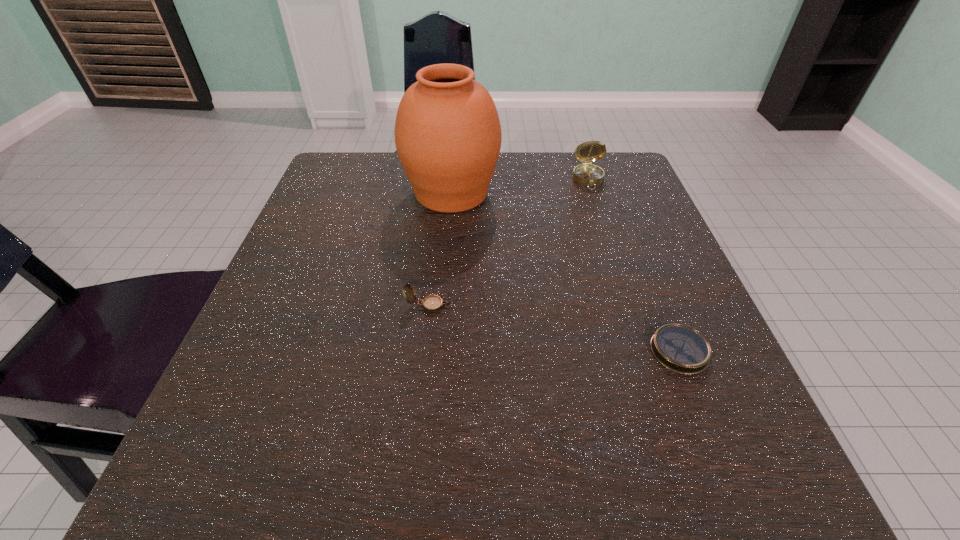
At what (x,y) coordinates should I click in order to perform the action: click on urn. Please return your answer as a coordinate pair (x, y). Looking at the image, I should click on (448, 136).

Where is `the second tallest object`? Image resolution: width=960 pixels, height=540 pixels. the second tallest object is located at coordinates (586, 174).

Locate an element on the screen. The image size is (960, 540). the farthest compass is located at coordinates (586, 174).

Image resolution: width=960 pixels, height=540 pixels. I want to click on the second shortest compass, so click(432, 303).

This screenshot has height=540, width=960. What are the coordinates of `the second shortest object` in the screenshot? It's located at (432, 303).

At what (x,y) coordinates should I click in order to perform the action: click on the nearest object. Please return your answer as a coordinate pair (x, y). Looking at the image, I should click on (679, 348).

Where is `the shortest object`? the shortest object is located at coordinates (679, 348).

Identify the location of free region located 0.060m on the back of the urn. (454, 156).

This screenshot has width=960, height=540. What are the coordinates of `vacant region located 0.400m with the dial facing the farthest compass` in the screenshot? It's located at (637, 328).

The width and height of the screenshot is (960, 540). Find the location of `free space located on the face of the second shortest object`. free space located on the face of the second shortest object is located at coordinates (691, 306).